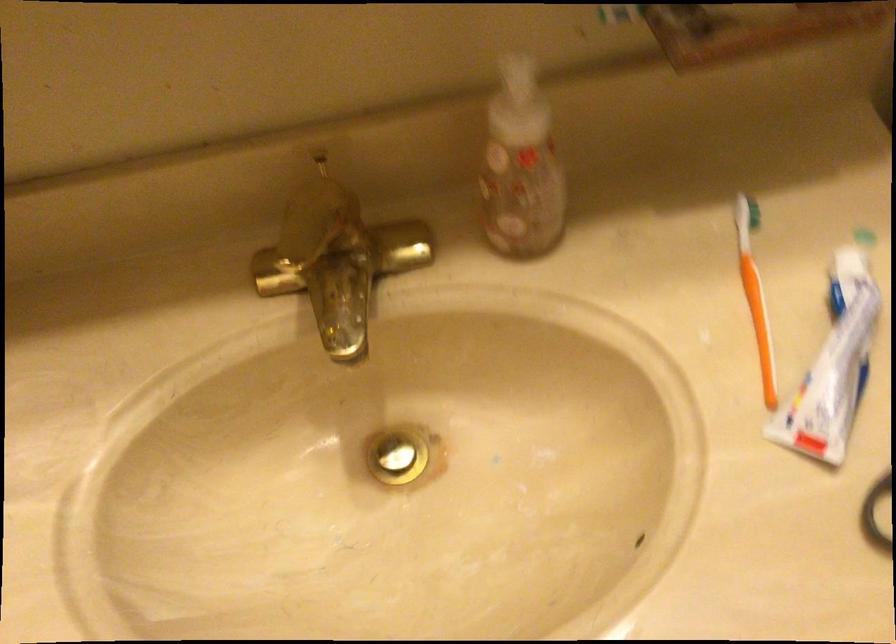
You are a GUI agent. You are given a task and a screenshot of the screen. Output one action in this format:
    pyautogui.click(x=<x>, y=<y>)
    Task: Click on the soap dispenser pump
    The height and width of the screenshot is (644, 896).
    Given the screenshot: What is the action you would take?
    pyautogui.click(x=521, y=167)